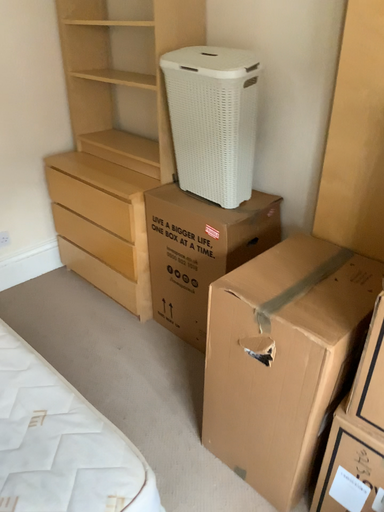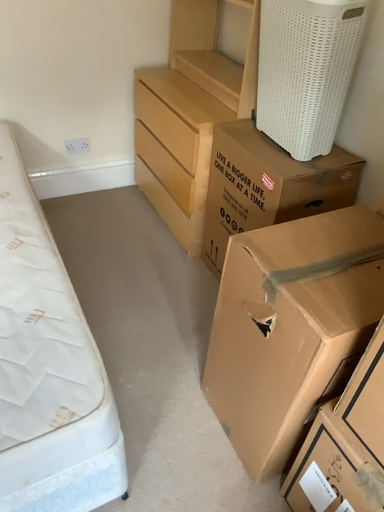
Question: How did the camera likely rotate when shooting the video?

Choices:
 (A) rotated upward
 (B) rotated downward

Answer: (B)